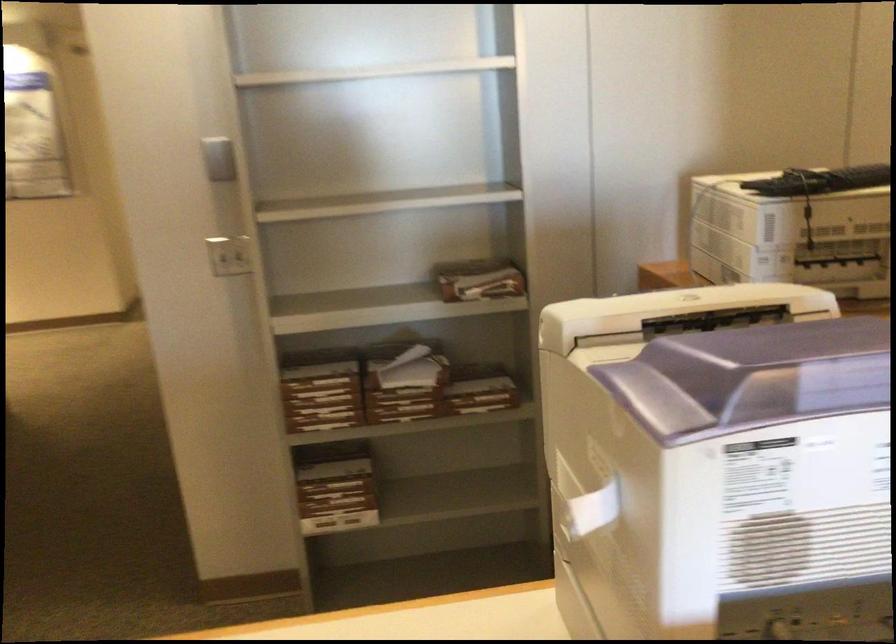
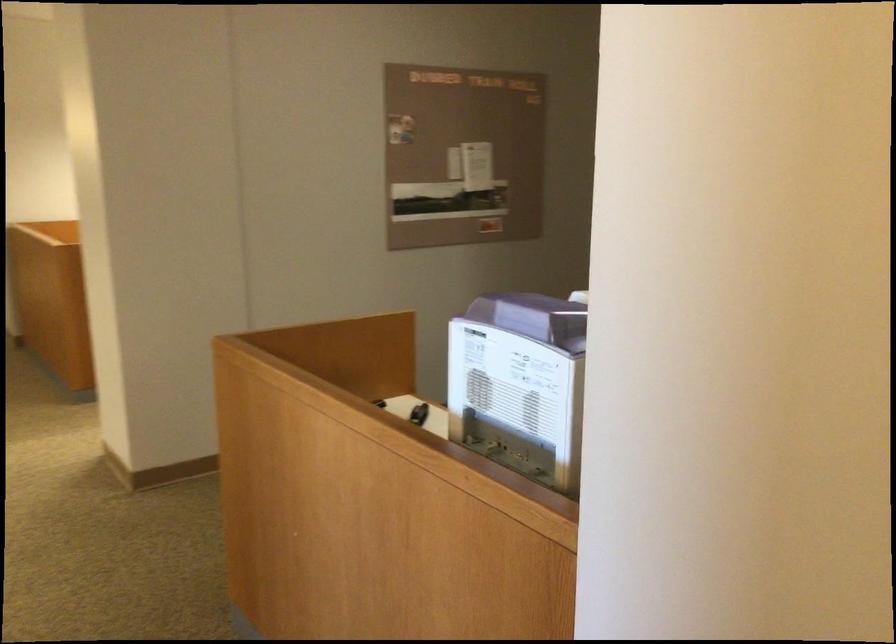
Question: I am providing you with two images of the same scene from different viewpoints. After the viewpoint changes to image2, which objects are now occluded?

Choices:
 (A) purple machine lid
 (B) small black object
 (C) integrated drawer handle
 (D) white light switch

Answer: (D)